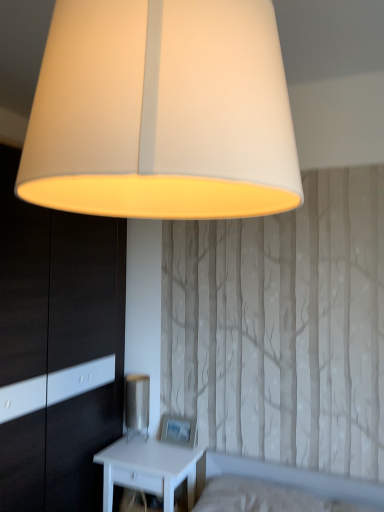
The height and width of the screenshot is (512, 384). I want to click on metallic silver table lamp at lower center, so click(137, 405).

This screenshot has height=512, width=384. Describe the element at coordinates (137, 405) in the screenshot. I see `metallic silver table lamp at lower center` at that location.

Where is `metallic silver table lamp at lower center`? Image resolution: width=384 pixels, height=512 pixels. metallic silver table lamp at lower center is located at coordinates (137, 405).

From a real-world perspective, which is physically above, matte white lampshade at upper center or metallic silver table lamp at lower center?

matte white lampshade at upper center is physically above.

Consider the image. Is matte white lampshade at upper center shorter than metallic silver table lamp at lower center?

In fact, matte white lampshade at upper center may be taller than metallic silver table lamp at lower center.

Does matte white lampshade at upper center lie in front of metallic silver table lamp at lower center?

That is True.

Can you confirm if white glossy dresser at left is shorter than matte white lampshade at upper center?

No.

Can you confirm if white glossy dresser at left is positioned to the left of matte white lampshade at upper center?

Yes, white glossy dresser at left is to the left of matte white lampshade at upper center.

Find the location of `lamp above the white glossy dresser at left (from the image's perspective)`. lamp above the white glossy dresser at left (from the image's perspective) is located at coordinates (162, 112).

Is point (11, 461) farther from viewer compared to point (97, 71)?

Yes, point (11, 461) is behind point (97, 71).

From the image's perspective, does metallic silver table lamp at lower center appear higher than white matte nightstand at lower left?

Yes, from the image's perspective, metallic silver table lamp at lower center is above white matte nightstand at lower left.

Considering the relative sizes of metallic silver table lamp at lower center and white matte nightstand at lower left in the image provided, is metallic silver table lamp at lower center shorter than white matte nightstand at lower left?

Yes, metallic silver table lamp at lower center is shorter than white matte nightstand at lower left.

In the scene shown: How many degrees apart are the facing directions of metallic silver table lamp at lower center and white matte nightstand at lower left?

0.428 degrees separate the facing orientations of metallic silver table lamp at lower center and white matte nightstand at lower left.

From the picture: Is metallic silver table lamp at lower center outside of white matte nightstand at lower left?

Absolutely, metallic silver table lamp at lower center is external to white matte nightstand at lower left.

Can you confirm if white matte nightstand at lower left is positioned to the left of matte white lampshade at upper center?

Correct, you'll find white matte nightstand at lower left to the left of matte white lampshade at upper center.

Can you confirm if white matte nightstand at lower left is shorter than matte white lampshade at upper center?

Correct, white matte nightstand at lower left is not as tall as matte white lampshade at upper center.

The width and height of the screenshot is (384, 512). I want to click on lamp on the right of the white matte nightstand at lower left, so click(162, 112).

Considering the relative sizes of white matte nightstand at lower left and matte white lampshade at upper center in the image provided, is white matte nightstand at lower left wider than matte white lampshade at upper center?

No.

Can you see white matte nightstand at lower left touching white glossy dresser at left?

No, white matte nightstand at lower left is not in contact with white glossy dresser at left.

Which is in front, point (111, 445) or point (124, 306)?

The point (111, 445) is more forward.

Can you confirm if white matte nightstand at lower left is bigger than white glossy dresser at left?

Incorrect, white matte nightstand at lower left is not larger than white glossy dresser at left.

Consider the image. Which object is thinner, white matte nightstand at lower left or white glossy dresser at left?

white matte nightstand at lower left.

Is point (14, 265) closer or farther from the camera than point (179, 461)?

Point (14, 265).

Measure the distance between white glossy dresser at left and white matte nightstand at lower left.

white glossy dresser at left and white matte nightstand at lower left are 19.05 inches apart from each other.

Based on the photo, from a real-world perspective, is white glossy dresser at left on top of white matte nightstand at lower left?

Indeed, from a real-world perspective, white glossy dresser at left stands above white matte nightstand at lower left.

Is white glossy dresser at left thinner than white matte nightstand at lower left?

Incorrect, the width of white glossy dresser at left is not less than that of white matte nightstand at lower left.

From the image's perspective, which one is positioned higher, white matte nightstand at lower left or metallic silver table lamp at lower center?

metallic silver table lamp at lower center appears higher in the image.

Is white matte nightstand at lower left further to camera compared to metallic silver table lamp at lower center?

That is False.

In the image, there is a metallic silver table lamp at lower center. Find the location of `lamp above it (from the image's perspective)`. lamp above it (from the image's perspective) is located at coordinates (162, 112).

Where is `lamp on the right of white glossy dresser at left`? Image resolution: width=384 pixels, height=512 pixels. lamp on the right of white glossy dresser at left is located at coordinates (162, 112).

From the image, which object appears to be nearer to matte white lampshade at upper center, metallic silver table lamp at lower center or white glossy dresser at left?

white glossy dresser at left is positioned closer to the anchor matte white lampshade at upper center.

When comparing their distances from metallic silver table lamp at lower center, does white glossy dresser at left or matte white lampshade at upper center seem closer?

white glossy dresser at left is positioned closer to the anchor metallic silver table lamp at lower center.

Considering their positions, is metallic silver table lamp at lower center positioned closer to white matte nightstand at lower left than white glossy dresser at left?

metallic silver table lamp at lower center is closer to white matte nightstand at lower left.

Considering their positions, is matte white lampshade at upper center positioned closer to white matte nightstand at lower left than metallic silver table lamp at lower center?

metallic silver table lamp at lower center is positioned closer to the anchor white matte nightstand at lower left.

Estimate the real-world distances between objects in this image. Which object is closer to metallic silver table lamp at lower center, white glossy dresser at left or white matte nightstand at lower left?

Among the two, white matte nightstand at lower left is located nearer to metallic silver table lamp at lower center.

Based on their spatial positions, is matte white lampshade at upper center or white matte nightstand at lower left further from white glossy dresser at left?

matte white lampshade at upper center is further to white glossy dresser at left.

Considering their positions, is matte white lampshade at upper center positioned closer to metallic silver table lamp at lower center than white glossy dresser at left?

white glossy dresser at left is closer to metallic silver table lamp at lower center.

Which object lies further to the anchor point white matte nightstand at lower left, metallic silver table lamp at lower center or matte white lampshade at upper center?

The object further to white matte nightstand at lower left is matte white lampshade at upper center.

Find the location of `nightstand between matte white lampshade at upper center and metallic silver table lamp at lower center in the front-back direction`. nightstand between matte white lampshade at upper center and metallic silver table lamp at lower center in the front-back direction is located at coordinates (152, 469).

I want to click on dresser that lies between matte white lampshade at upper center and white matte nightstand at lower left from top to bottom, so click(x=58, y=346).

You are a GUI agent. You are given a task and a screenshot of the screen. Output one action in this format:
    pyautogui.click(x=<x>, y=<y>)
    Task: Click on the nightstand located between white glossy dresser at left and metallic silver table lamp at lower center in the depth direction
    
    Given the screenshot: What is the action you would take?
    pyautogui.click(x=152, y=469)

Image resolution: width=384 pixels, height=512 pixels. Identify the location of dresser between matte white lampshade at upper center and metallic silver table lamp at lower center along the z-axis. tap(58, 346).